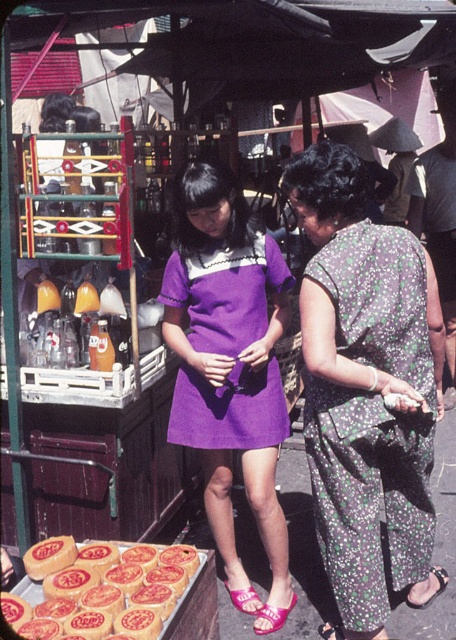
Question: Is floral-patterned dress at center thinner than matte black sandal at lower right?

Choices:
 (A) yes
 (B) no

Answer: (B)

Question: Does floral fabric dress at center appear on the right side of matte black sandal at lower right?

Choices:
 (A) yes
 (B) no

Answer: (A)

Question: Which point appears closest to the camera in this image?

Choices:
 (A) (341, 157)
 (B) (221, 310)
 (C) (442, 588)

Answer: (A)

Question: Which of the following is the closest to the observer?

Choices:
 (A) (88, 554)
 (B) (337, 154)

Answer: (A)

Question: Is floral fabric dress at center below matte black sandal at lower right?

Choices:
 (A) yes
 (B) no

Answer: (B)

Question: Which is farther from the floral-patterned dress at center?

Choices:
 (A) purple fabric dress at center
 (B) pink fabric sandal at lower center

Answer: (B)